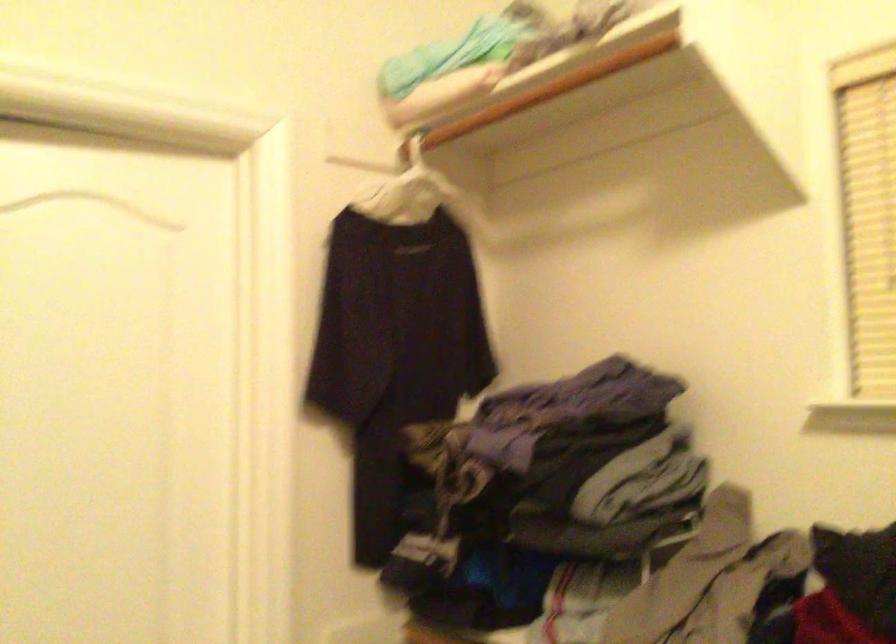
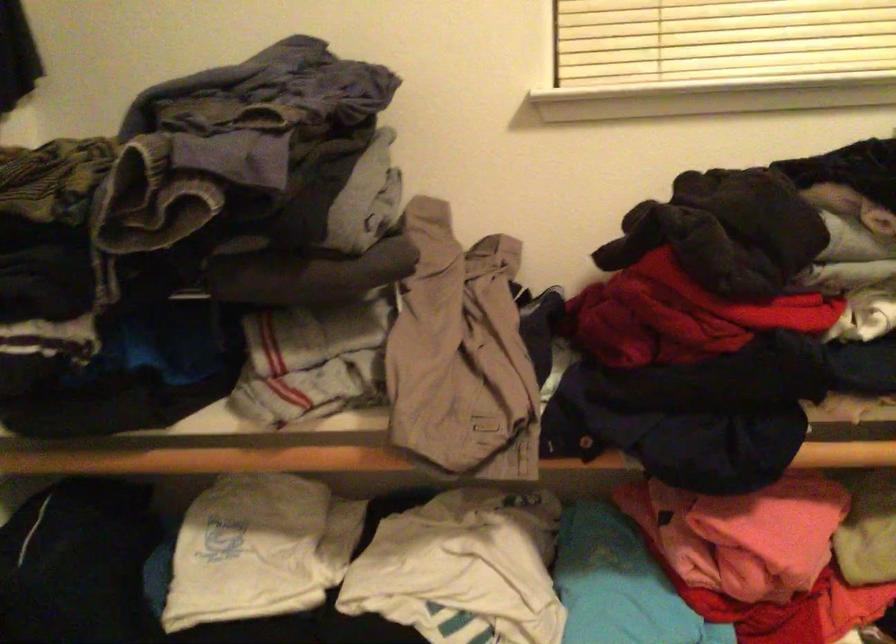
First-person continuous shooting, in which direction is the camera rotating?

The rotation direction of the camera is right-down.